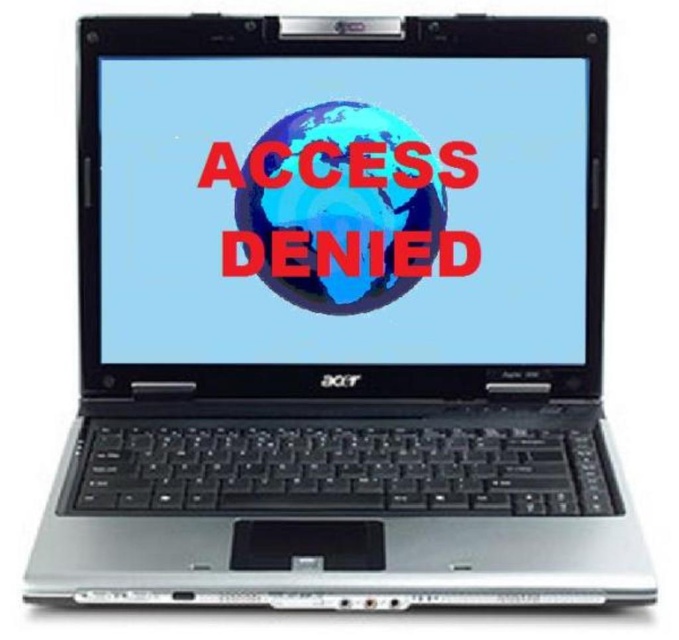
You are trying to access a secure system and see the laptop with the matte plastic screen at center and the blue glossy globe at center. Which object is positioned lower on the screen?

The matte plastic screen at center is located below the blue glossy globe at center, so it is positioned lower on the screen.

You are a quality control inspector examining the laptop displayed in the image. You need to check the material of the screen at point (344, 209). What is the material of the screen at that point?

The material of the screen at point (344, 209) is matte plastic.

You are trying to determine if the matte plastic screen at center can fully display the blue glossy globe at center. Based on their sizes, can the globe fit entirely on the screen?

The matte plastic screen at center is larger than the blue glossy globe at center, so the globe can fit entirely on the screen.